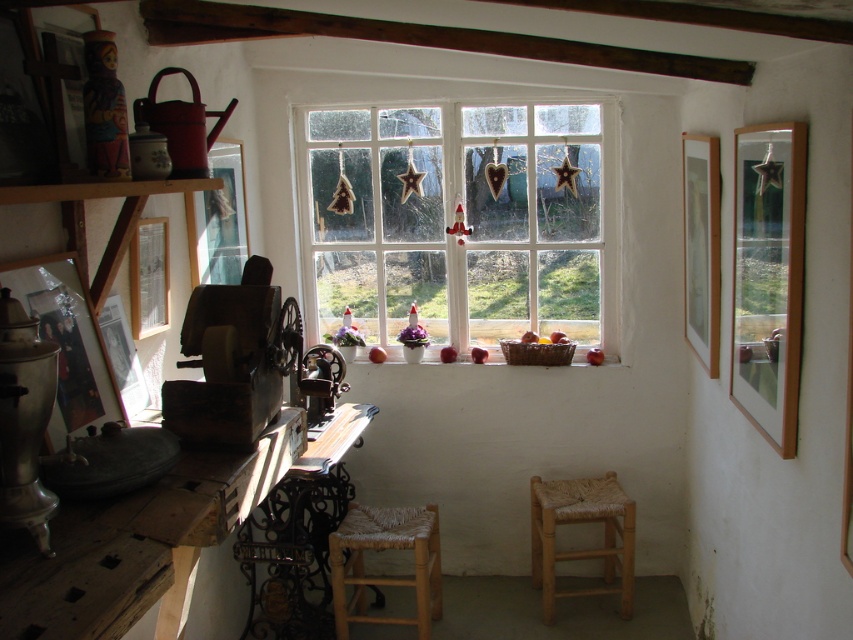
Question: Observing the image, what is the correct spatial positioning of wooden at left in reference to wooden woven stool at center?

Choices:
 (A) left
 (B) right

Answer: (A)

Question: Based on their relative distances, which object is nearer to the white wooden window at center?

Choices:
 (A) wooden at left
 (B) woven wood stool at lower center
 (C) metallic/brass-like chair at center
 (D) wooden woven stool at center

Answer: (C)

Question: Which of the following is the closest to the observer?

Choices:
 (A) woven wood stool at lower center
 (B) wooden at left
 (C) white wooden window at center
 (D) metallic/brass-like chair at center

Answer: (B)

Question: Among these objects, which one is farthest from the camera?

Choices:
 (A) woven wood stool at lower center
 (B) wooden woven stool at center

Answer: (B)

Question: Is white wooden window at center further to the viewer compared to wooden at left?

Choices:
 (A) no
 (B) yes

Answer: (B)

Question: Can you confirm if white wooden window at center is positioned above wooden woven stool at center?

Choices:
 (A) yes
 (B) no

Answer: (A)